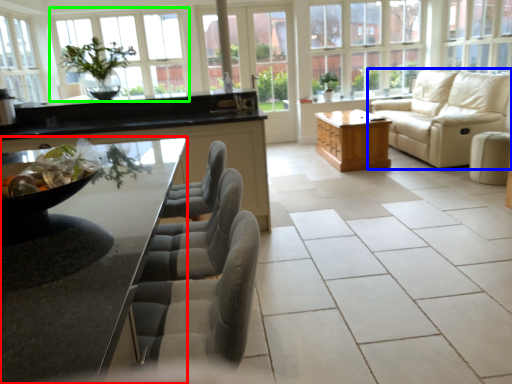
Question: Estimate the real-world distances between objects in this image. Which object is closer to countertop (highlighted by a red box), studio couch (highlighted by a blue box) or window (highlighted by a green box)?

Choices:
 (A) studio couch
 (B) window

Answer: (A)